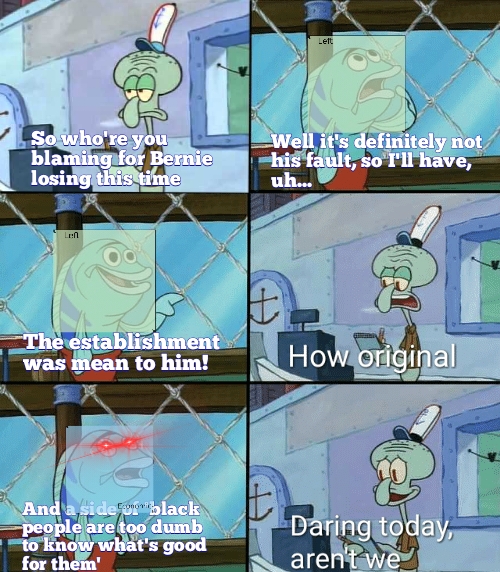
This screenshot has width=500, height=572. I want to click on cash register, so click(287, 544), click(303, 336), click(22, 170).